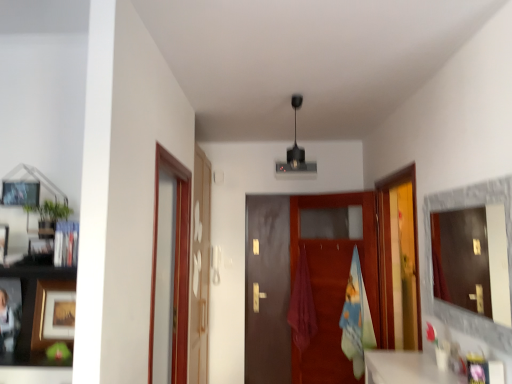
Question: Is transparent glass door at left, the 2th glass door when ordered from left to right, next to transparent glass door at right, which appears as the first glass door when viewed from the right?

Choices:
 (A) yes
 (B) no

Answer: (B)

Question: Does transparent glass door at left, the 2th glass door when ordered from left to right, have a lesser height compared to transparent glass door at right, which appears as the first glass door when viewed from the right?

Choices:
 (A) no
 (B) yes

Answer: (A)

Question: From the image's perspective, would you say transparent glass door at left, placed as the 2th glass door when sorted from right to left, is positioned over transparent glass door at right, which appears as the first glass door when viewed from the right?

Choices:
 (A) no
 (B) yes

Answer: (A)

Question: Does transparent glass door at left, the 2th glass door when ordered from left to right, have a smaller size compared to transparent glass door at right, which appears as the first glass door when viewed from the right?

Choices:
 (A) yes
 (B) no

Answer: (B)

Question: Could you tell me if transparent glass door at left, the 2th glass door when ordered from left to right, is facing transparent glass door at right, which appears as the first glass door when viewed from the right?

Choices:
 (A) yes
 (B) no

Answer: (A)

Question: Is transparent glass door at left, placed as the 2th glass door when sorted from right to left, bigger or smaller than transparent glass door at right, which appears as the first glass door when viewed from the right?

Choices:
 (A) big
 (B) small

Answer: (A)

Question: In terms of height, does transparent glass door at left, placed as the 2th glass door when sorted from right to left, look taller or shorter compared to transparent glass door at right, which appears as the first glass door when viewed from the right?

Choices:
 (A) tall
 (B) short

Answer: (A)

Question: Which is correct: transparent glass door at left, the 2th glass door when ordered from left to right, is inside transparent glass door at right, which appears as the first glass door when viewed from the right, or outside of it?

Choices:
 (A) outside
 (B) inside

Answer: (A)

Question: Is point (192, 284) positioned closer to the camera than point (391, 193)?

Choices:
 (A) farther
 (B) closer

Answer: (B)

Question: Is transparent glass door at left, the 2th glass door when ordered from left to right, bigger or smaller than wooden matte picture frame at left, the 1th picture frame from the back?

Choices:
 (A) small
 (B) big

Answer: (B)

Question: In terms of width, does transparent glass door at left, placed as the 2th glass door when sorted from right to left, look wider or thinner when compared to wooden matte picture frame at left, which is counted as the 3th picture frame, starting from the front?

Choices:
 (A) wide
 (B) thin

Answer: (A)

Question: From their relative heights in the image, would you say transparent glass door at left, the 2th glass door when ordered from left to right, is taller or shorter than wooden matte picture frame at left, the 1th picture frame from the back?

Choices:
 (A) tall
 (B) short

Answer: (A)

Question: Is point (198, 244) closer or farther from the camera than point (51, 284)?

Choices:
 (A) closer
 (B) farther

Answer: (B)

Question: Looking at their shapes, would you say matte gray mirror at right is wider or thinner than brown matte door at center?

Choices:
 (A) thin
 (B) wide

Answer: (A)

Question: In the image, is matte gray mirror at right on the left side or the right side of brown matte door at center?

Choices:
 (A) left
 (B) right

Answer: (B)